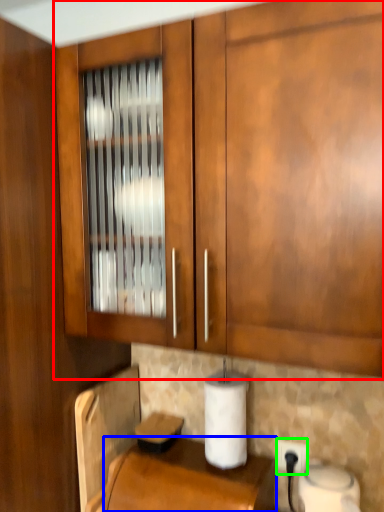
Question: Which object is positioned closest to cabinetry (highlighted by a red box)? Select from counter top (highlighted by a blue box) and electric outlet (highlighted by a green box).

Choices:
 (A) counter top
 (B) electric outlet

Answer: (A)